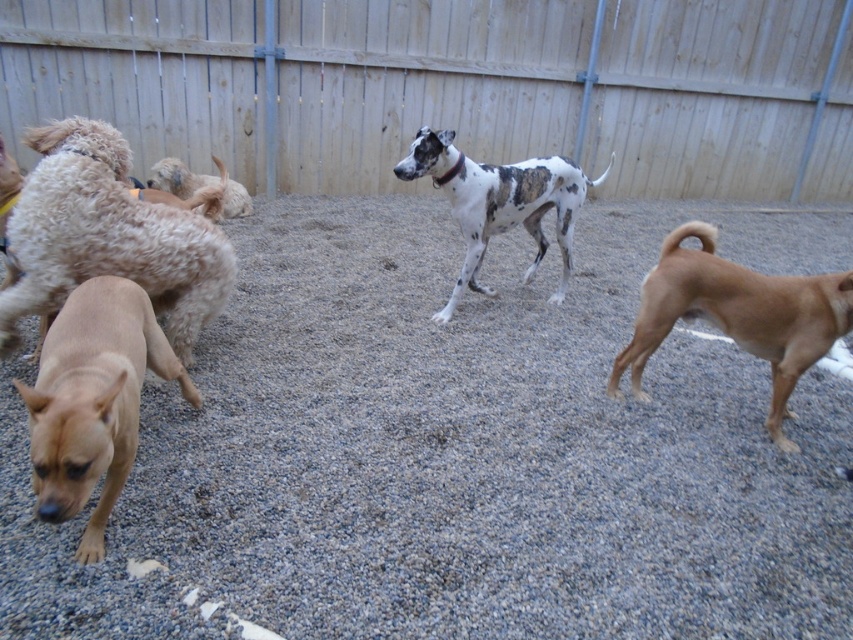
Who is more forward, (128, 285) or (612, 387)?

Point (128, 285)

Does point (143, 353) come closer to viewer compared to point (782, 394)?

Yes, point (143, 353) is in front of point (782, 394).

The height and width of the screenshot is (640, 853). Find the location of `brown matte dog at lower left`. brown matte dog at lower left is located at coordinates (93, 401).

Is gray gravel at lower left closer to the viewer compared to wooden fence at upper center?

Yes.

Is gray gravel at lower left above wooden fence at upper center?

Incorrect, gray gravel at lower left is not positioned above wooden fence at upper center.

Who is more forward, (723, 440) or (764, 86)?

Point (723, 440) is in front.

At what (x,y) coordinates should I click in order to perform the action: click on gray gravel at lower left. Please return your answer as a coordinate pair (x, y). Image resolution: width=853 pixels, height=640 pixels. Looking at the image, I should click on (457, 451).

Is gray gravel at lower left positioned behind brown smooth dog at right?

No, it is not.

Which is in front, point (740, 579) or point (664, 328)?

Point (740, 579) is in front.

Which is behind, point (196, 515) or point (821, 291)?

The point (821, 291) is behind.

This screenshot has height=640, width=853. I want to click on gray gravel at lower left, so click(457, 451).